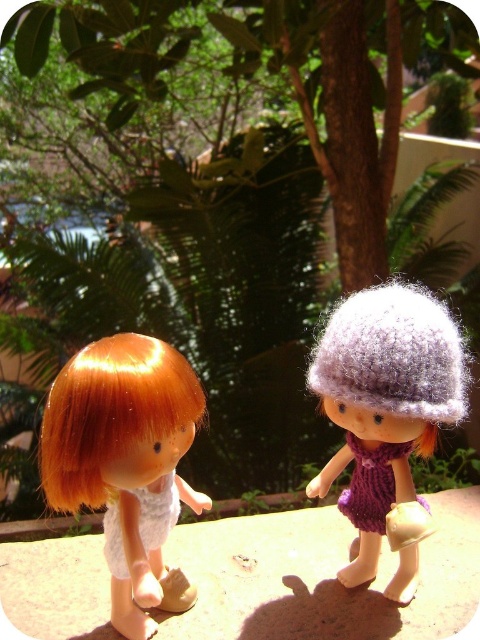
Looking at this image, you are a photographer trying to capture both the shiny orange hair at center and the purple knitted hat at right in a single frame. Based on their sizes, which object should you focus on first to ensure both are in focus?

Since the shiny orange hair at center occupies less space than the purple knitted hat at right, you should focus on the shiny orange hair at center first. This ensures that the smaller object is sharp, and the larger purple knitted hat at right will naturally fall into focus due to its size.

You are a photographer setting up a shot of the dolls. You need to ensure that both the shiny orange hair at center and the purple knitted hat at right are visible in the frame. Given their heights, which object should you adjust the camera angle to focus on first to capture both?

The shiny orange hair at center is shorter than the purple knitted hat at right. To capture both in the frame, adjust the camera angle to focus on the shorter shiny orange hair at center first, then ensure the taller purple knitted hat at right is also in view.

You are a photographer setting up a shot of the two dolls in the scene. You want to focus on the doll closer to the camera. Which doll should you choose between the doll at point (192,396) and the doll at point (407,598)?

The doll at point (192,396) is closer to the camera than the doll at point (407,598), so you should focus on the doll at point (192,396).